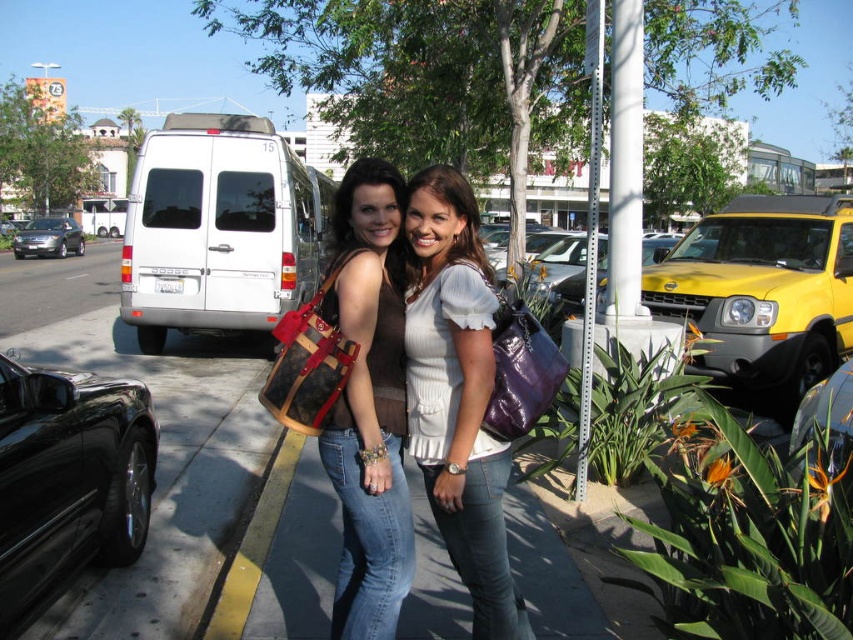
Measure the distance between white matte van at center and camera.

white matte van at center and camera are 28.50 feet apart.

I want to click on white matte van at center, so 219,228.

What do you see at coordinates (219, 228) in the screenshot? This screenshot has width=853, height=640. I see `white matte van at center` at bounding box center [219, 228].

The image size is (853, 640). Identify the location of white matte van at center. (219, 228).

Does black glossy car at lower left come behind brown leather bucket bag at center?

Yes, black glossy car at lower left is further from the viewer.

Can you confirm if black glossy car at lower left is bigger than brown leather bucket bag at center?

Indeed, black glossy car at lower left has a larger size compared to brown leather bucket bag at center.

Locate an element on the screen. black glossy car at lower left is located at coordinates click(68, 480).

Who is taller, smooth concrete sidewalk at center or brown leather purse at center?

With more height is brown leather purse at center.

How much distance is there between smooth concrete sidewalk at center and brown leather purse at center?

9.78 feet

Is point (86, 621) in front of point (376, 291)?

That is False.

Where is `smooth concrete sidewalk at center`? The width and height of the screenshot is (853, 640). smooth concrete sidewalk at center is located at coordinates (167, 477).